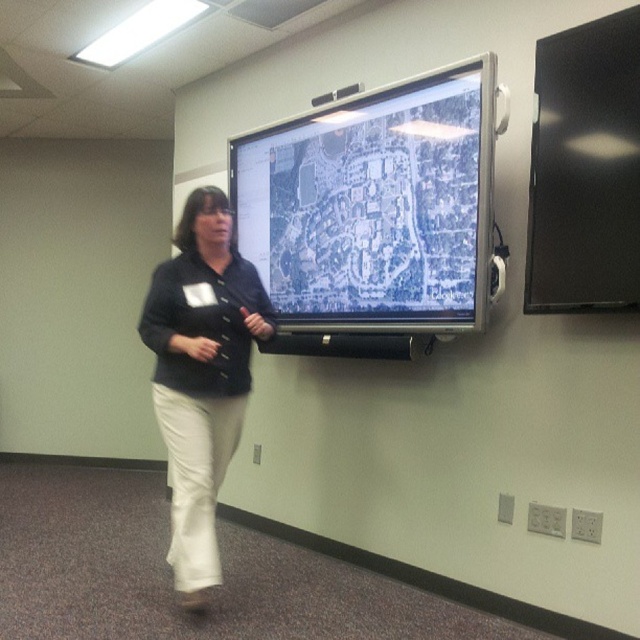
Question: Among these points, which one is farthest from the camera?

Choices:
 (A) (465, 161)
 (B) (179, 593)
 (C) (636, 189)

Answer: (B)

Question: Is white matte projection screen at upper center wider than black glossy screen at upper right?

Choices:
 (A) yes
 (B) no

Answer: (A)

Question: Does white matte projection screen at upper center appear on the right side of black glossy screen at upper right?

Choices:
 (A) no
 (B) yes

Answer: (A)

Question: Estimate the real-world distances between objects in this image. Which object is closer to the white matte projection screen at upper center?

Choices:
 (A) black glossy screen at upper right
 (B) matte black shirt at center

Answer: (A)

Question: Is white matte projection screen at upper center bigger than black glossy screen at upper right?

Choices:
 (A) no
 (B) yes

Answer: (B)

Question: Which object is the farthest from the black glossy screen at upper right?

Choices:
 (A) white matte projection screen at upper center
 (B) matte black shirt at center

Answer: (B)